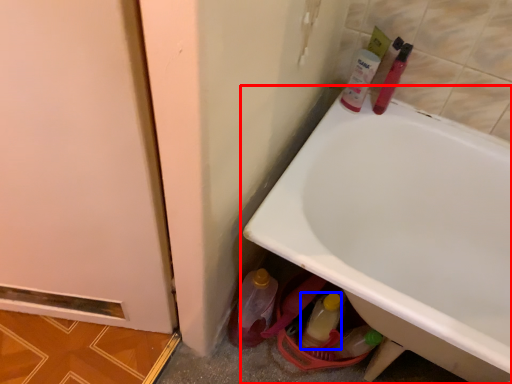
Question: Which point is closer to the camera, bathtub (highlighted by a red box) or bottle (highlighted by a blue box)?

Choices:
 (A) bathtub
 (B) bottle

Answer: (A)